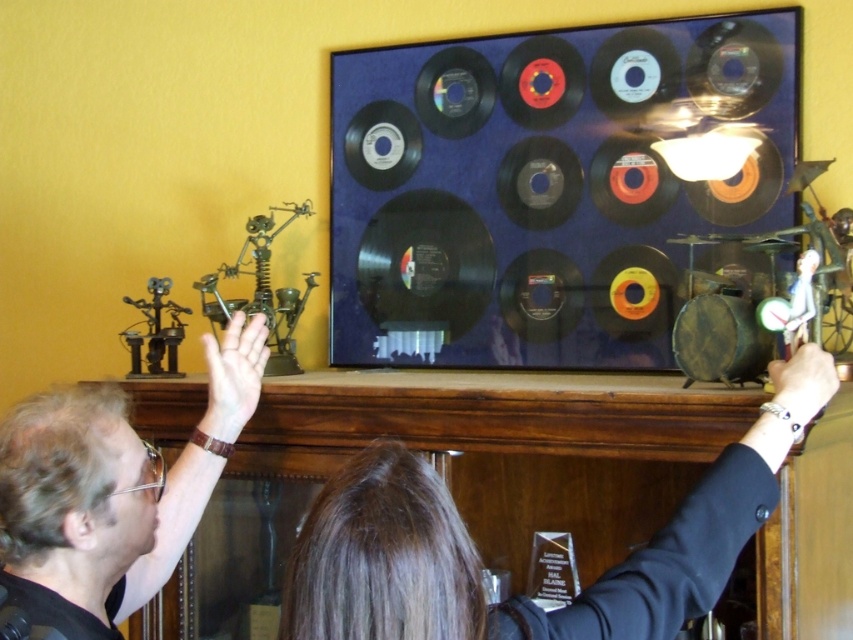
Question: Which of the following is the closest to the observer?

Choices:
 (A) brown hair at upper center
 (B) matte black shirt at upper left

Answer: (A)

Question: Is brown hair at upper center bigger than matte black shirt at upper left?

Choices:
 (A) yes
 (B) no

Answer: (A)

Question: Does brown hair at upper center appear over matte black shirt at upper left?

Choices:
 (A) yes
 (B) no

Answer: (A)

Question: Which object is closer to the camera taking this photo?

Choices:
 (A) brown hair at upper center
 (B) matte black shirt at upper left

Answer: (A)

Question: Does brown hair at upper center appear under matte black shirt at upper left?

Choices:
 (A) no
 (B) yes

Answer: (A)